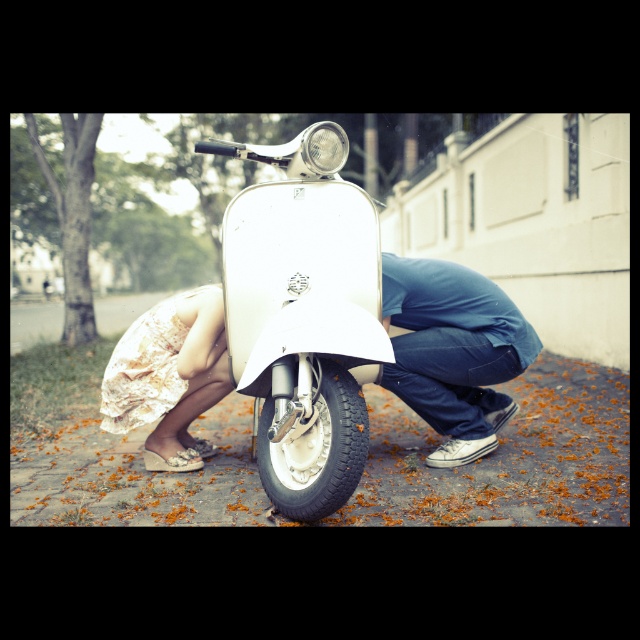
Question: Which point appears closest to the camera in this image?

Choices:
 (A) (294, 433)
 (B) (472, 384)

Answer: (A)

Question: Which object appears closest to the camera in this image?

Choices:
 (A) white floral dress at lower left
 (B) blue denim jeans at lower center
 (C) white glossy scooter at center

Answer: (C)

Question: Can you confirm if white glossy scooter at center is thinner than white floral dress at lower left?

Choices:
 (A) yes
 (B) no

Answer: (B)

Question: Estimate the real-world distances between objects in this image. Which object is closer to the blue denim jeans at lower center?

Choices:
 (A) white glossy scooter at center
 (B) white floral dress at lower left

Answer: (A)

Question: Does blue denim jeans at lower center appear on the right side of white floral dress at lower left?

Choices:
 (A) no
 (B) yes

Answer: (B)

Question: Does blue denim jeans at lower center have a larger size compared to white floral dress at lower left?

Choices:
 (A) yes
 (B) no

Answer: (A)